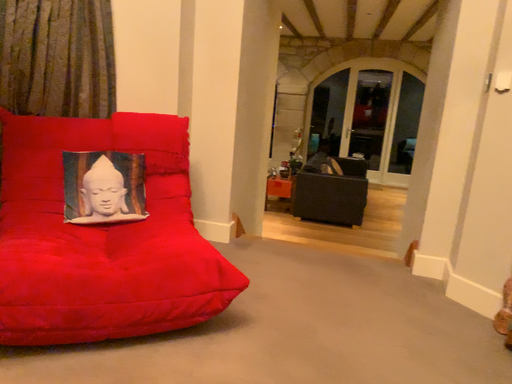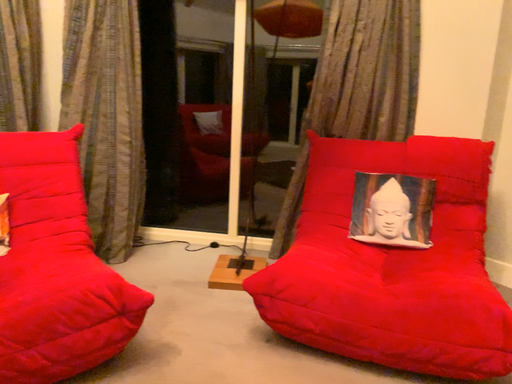
Question: How did the camera likely rotate when shooting the video?

Choices:
 (A) rotated left
 (B) rotated right

Answer: (A)